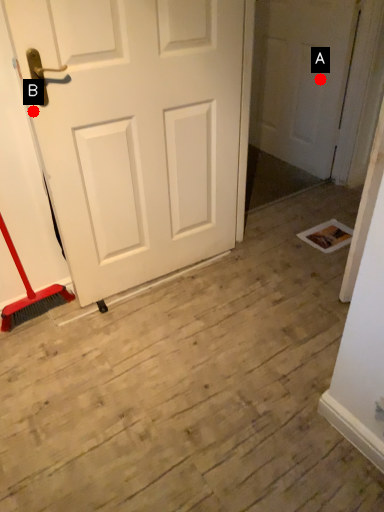
Question: Two points are circled on the image, labeled by A and B beside each circle. Which point is farther to the camera?

Choices:
 (A) A is further
 (B) B is further

Answer: (A)